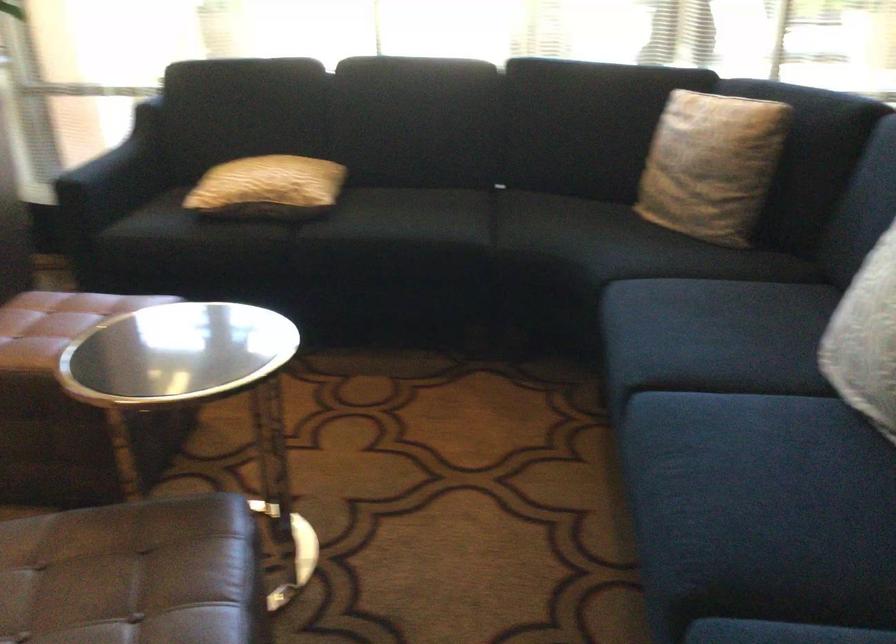
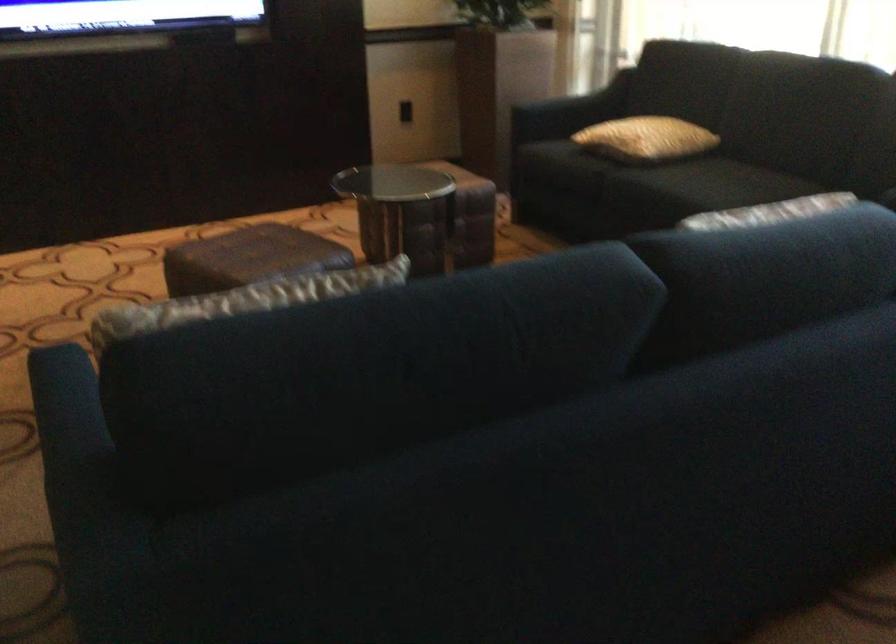
Find the pixel in the second image that matches point (306, 185) in the first image.

(645, 138)